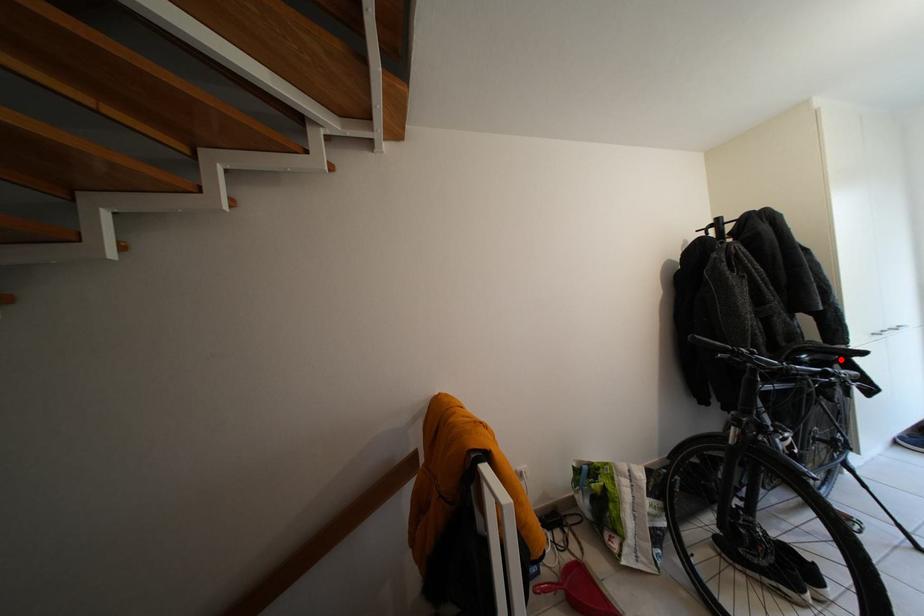
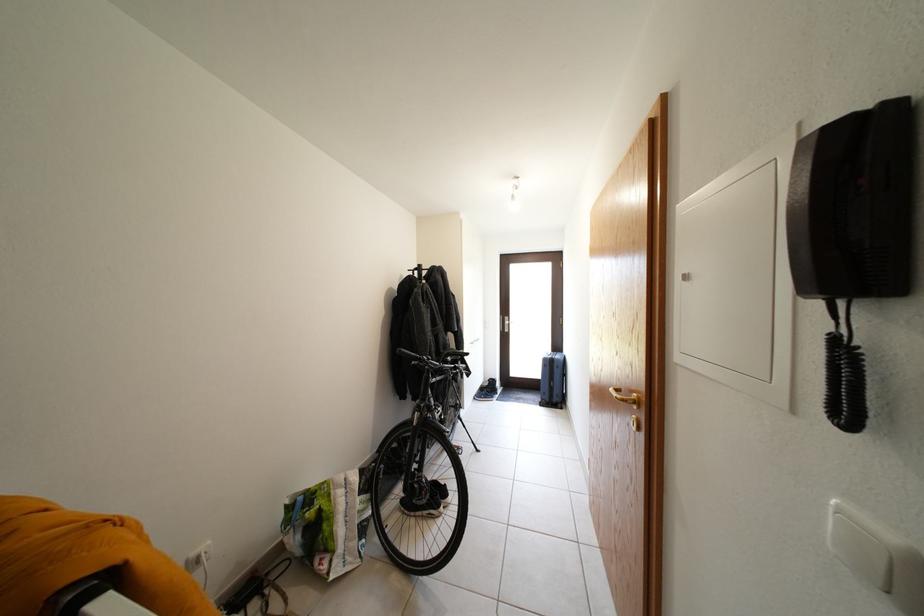
Question: I am providing you with two images of the same scene from different viewpoints. In image1, a red point is highlighted. Considering the same 3D point in image2, which of the following is correct?

Choices:
 (A) It is closer
 (B) It is farther

Answer: (B)